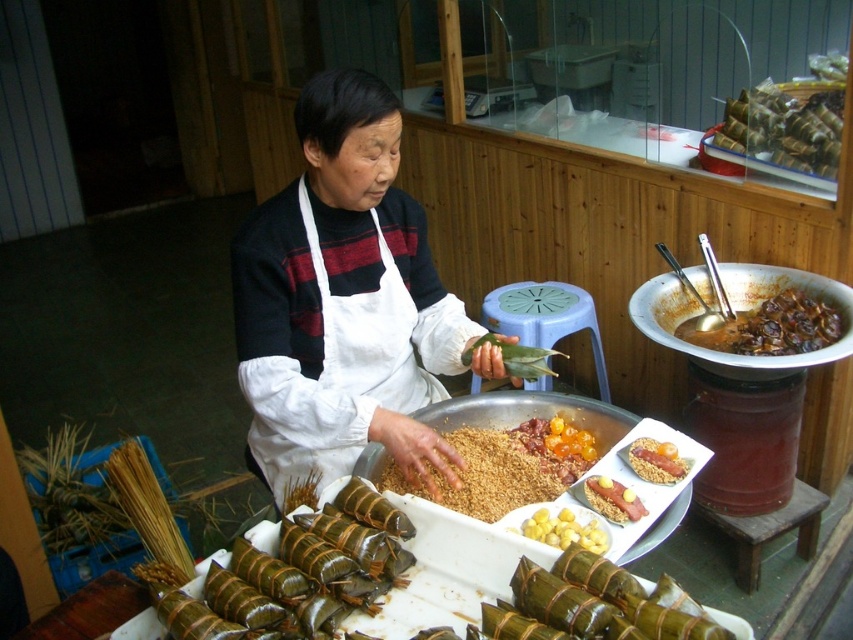
Based on the photo, you are a customer at the market stall and want to take a photo of the ingredients on the tray. You notice two points on the tray labeled as point (x=544, y=536) and point (x=682, y=461). Which point should you focus on to ensure the closer one is in sharp focus?

Point (x=544, y=536) is closer to the camera than point (x=682, y=461), so you should focus on point (x=544, y=536) to ensure the closer one is in sharp focus.

You are a customer at the market stall and want to know which object is bigger between the green bamboo leaves at lower left and the yellow matte rice at center. Can you tell me?

The green bamboo leaves at lower left are larger in size than the yellow matte rice at center.